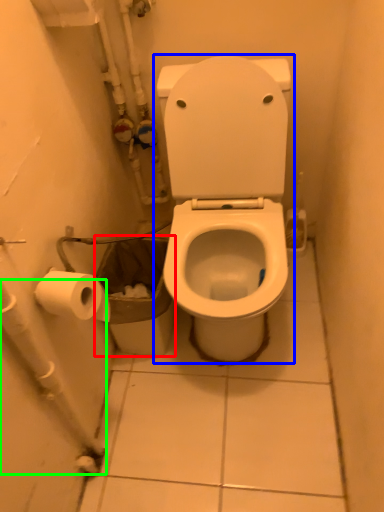
Question: Considering the real-world distances, which object is closest to garbage (highlighted by a red box)? toilet (highlighted by a blue box) or water pipe (highlighted by a green box).

Choices:
 (A) toilet
 (B) water pipe

Answer: (A)